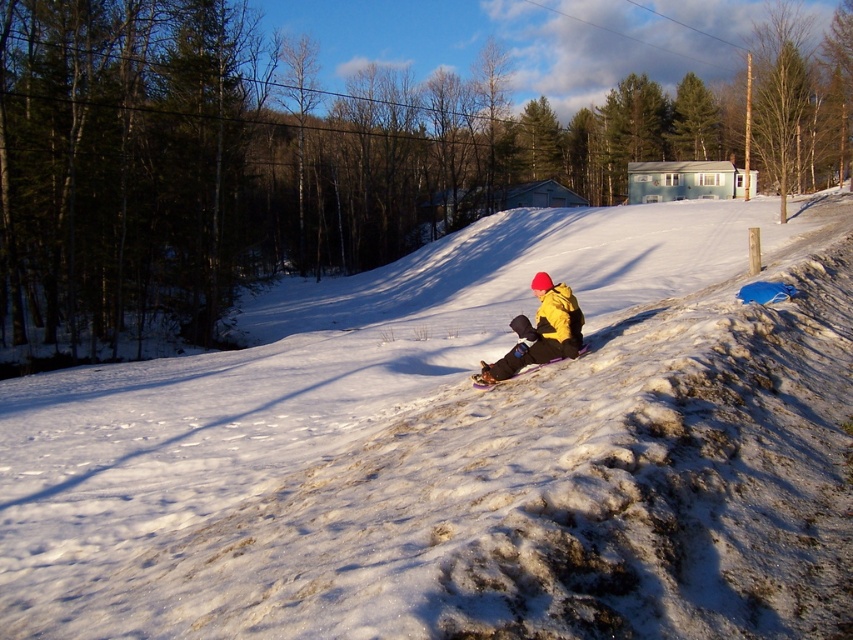
Question: Which point is closer to the camera?

Choices:
 (A) purple plastic snowboard at center
 (B) yellow matte jacket at center

Answer: (B)

Question: Considering the real-world distances, which object is closest to the purple plastic snowboard at center?

Choices:
 (A) yellow matte jacket at center
 (B) white fluffy snow at center

Answer: (A)

Question: Is yellow matte jacket at center bigger than purple plastic snowboard at center?

Choices:
 (A) no
 (B) yes

Answer: (B)

Question: Is white fluffy snow at center closer to camera compared to purple plastic snowboard at center?

Choices:
 (A) no
 (B) yes

Answer: (B)

Question: Considering the real-world distances, which object is closest to the yellow matte jacket at center?

Choices:
 (A) white fluffy snow at center
 (B) purple plastic snowboard at center

Answer: (B)

Question: Can you confirm if white fluffy snow at center is positioned above yellow matte jacket at center?

Choices:
 (A) no
 (B) yes

Answer: (B)